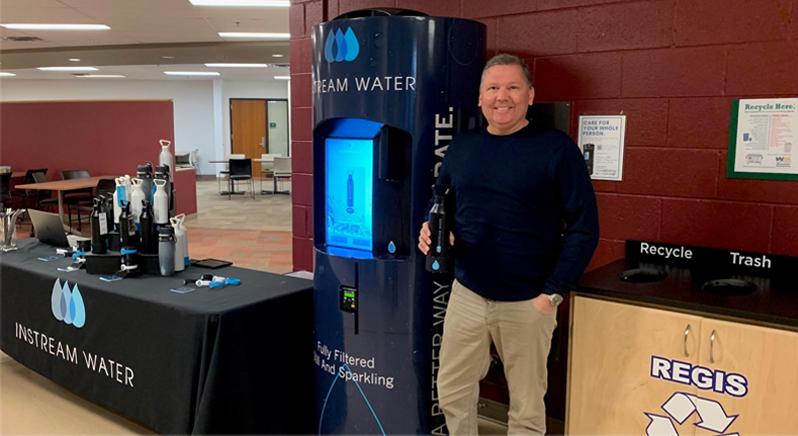
Locate an element on the screen. The width and height of the screenshot is (798, 436). trash section is located at coordinates (725, 284).